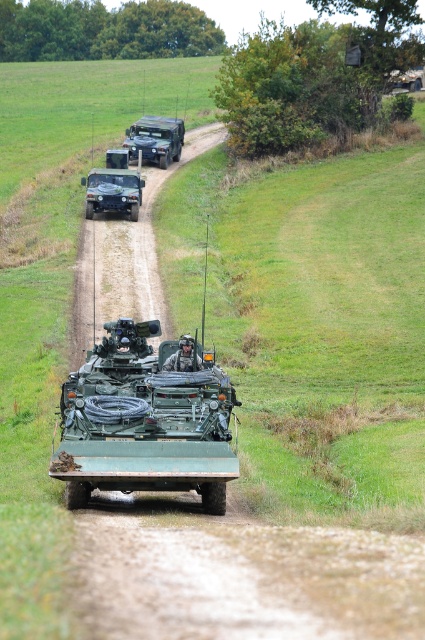
Question: Which point is farther from the camera taking this photo?

Choices:
 (A) (180, 140)
 (B) (99, 193)

Answer: (A)

Question: Which is nearer to the matte green jeep at center?

Choices:
 (A) green matte tank at center
 (B) matte green military vehicle at center

Answer: (B)

Question: Is green matte tank at center to the left of matte green military vehicle at center from the viewer's perspective?

Choices:
 (A) no
 (B) yes

Answer: (A)

Question: Estimate the real-world distances between objects in this image. Which object is closer to the matte green military vehicle at center?

Choices:
 (A) matte green jeep at center
 (B) green matte tank at center

Answer: (A)

Question: Where is green matte tank at center located in relation to matte green military vehicle at center in the image?

Choices:
 (A) above
 (B) below

Answer: (B)

Question: Considering the relative positions of green matte tank at center and matte green military vehicle at center in the image provided, where is green matte tank at center located with respect to matte green military vehicle at center?

Choices:
 (A) below
 (B) above

Answer: (A)